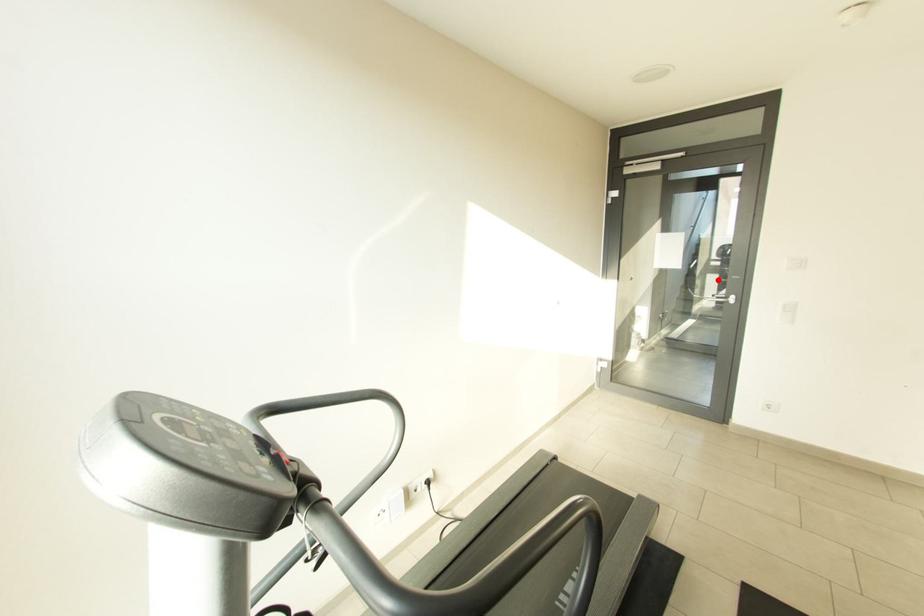
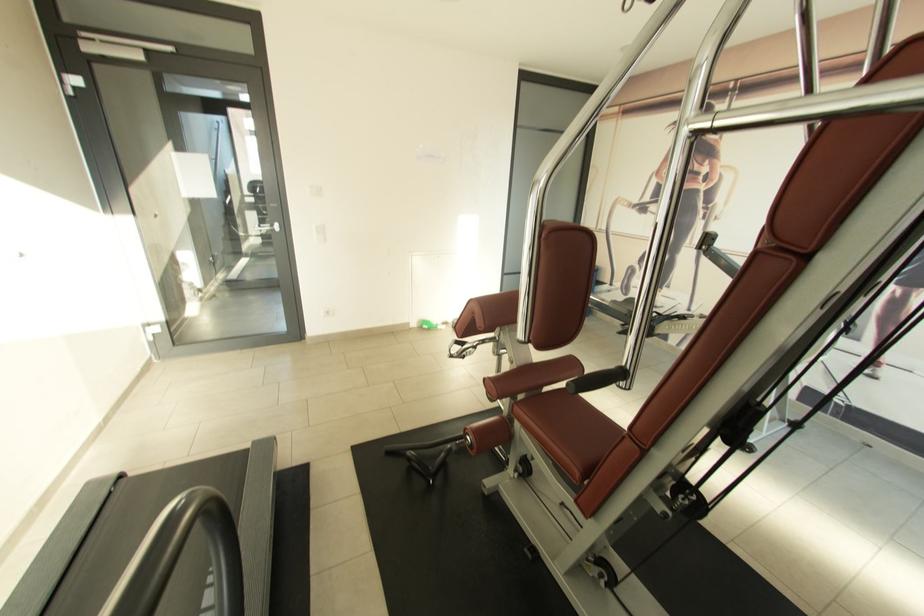
Question: I am providing you with two images of the same scene from different viewpoints. Given a red point in image1, look at the same physical point in image2. Is it:

Choices:
 (A) Closer to the viewpoint
 (B) Farther from the viewpoint

Answer: (B)